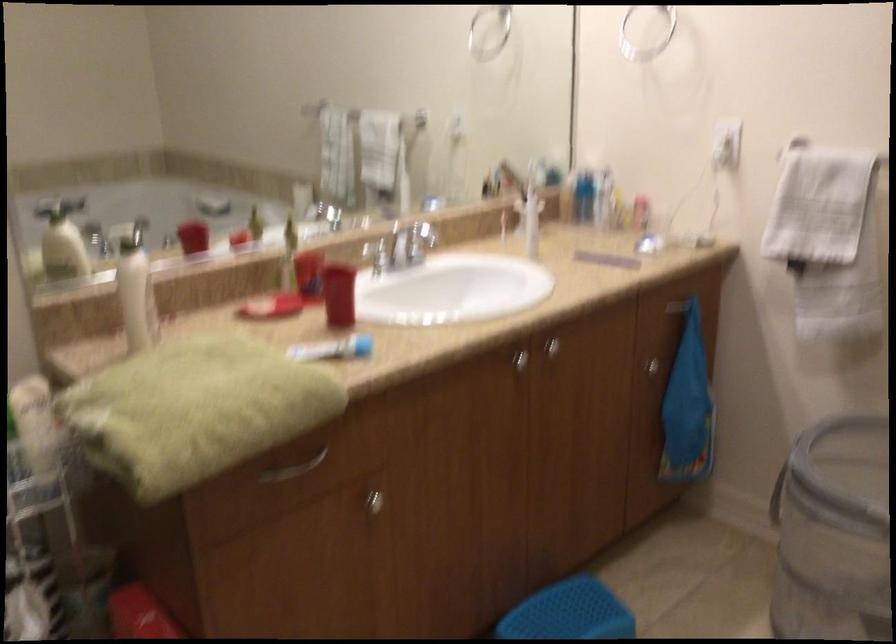
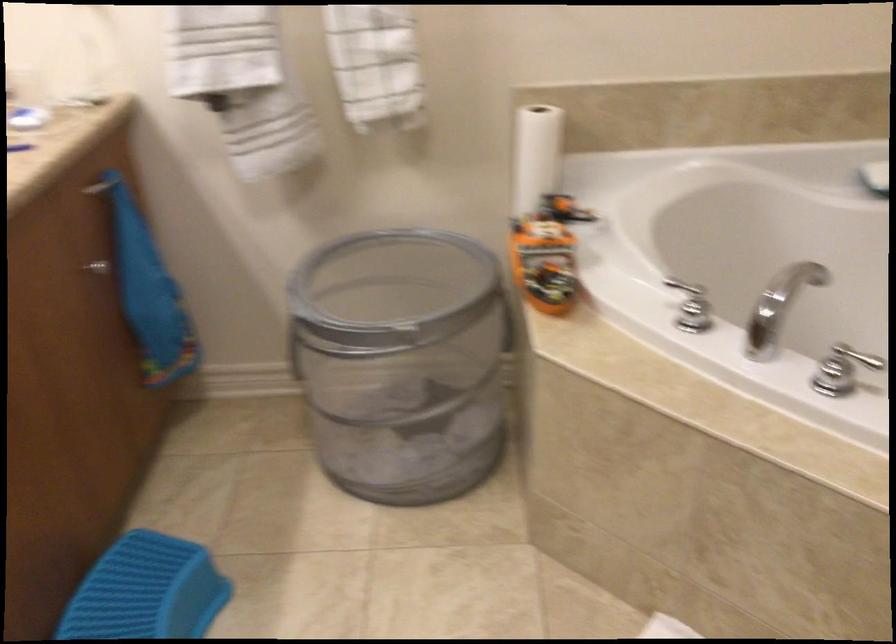
How did the camera likely rotate?

The rotation direction of the camera is right-down.